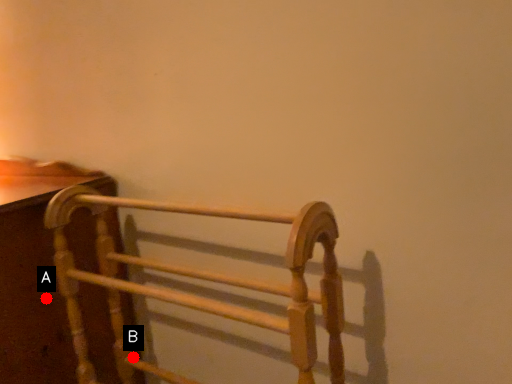
Question: Two points are circled on the image, labeled by A and B beside each circle. Which point is farther to the camera?

Choices:
 (A) A is further
 (B) B is further

Answer: (B)